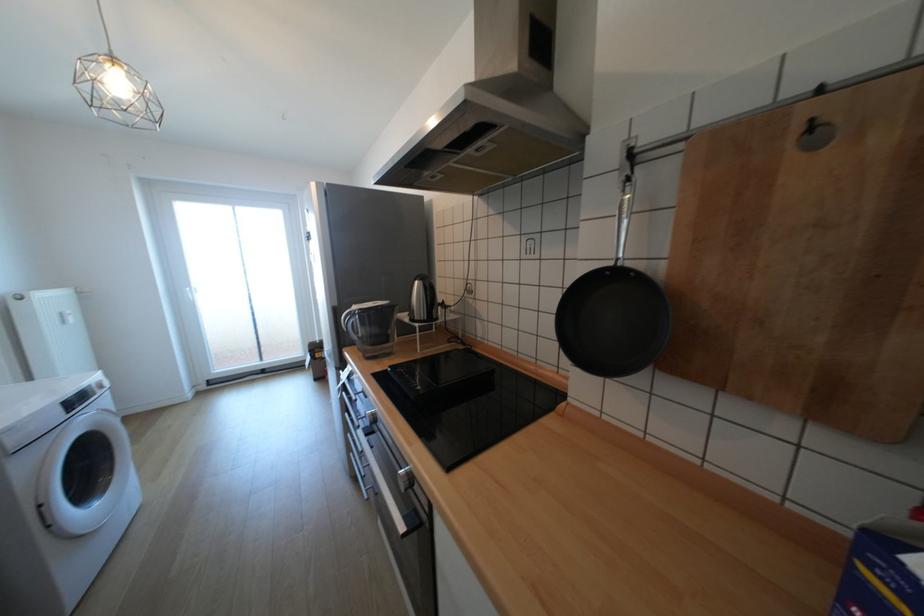
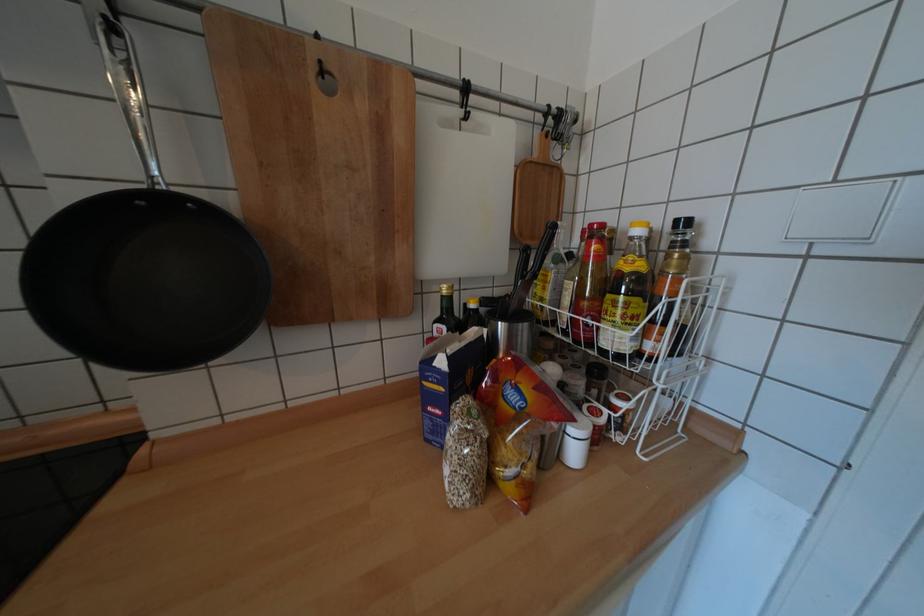
Locate, in the second image, the point that corresponds to (x=816, y=136) in the first image.

(330, 79)